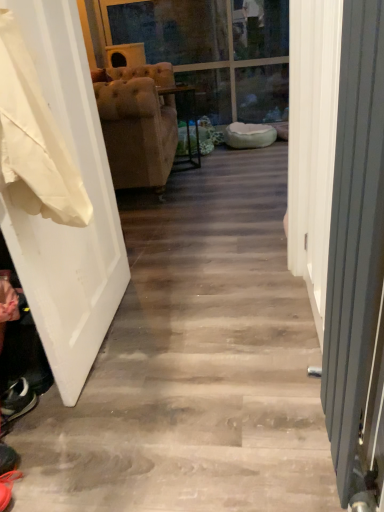
Question: Is transparent glass door at upper center bigger than metallic gray radiator at right?

Choices:
 (A) yes
 (B) no

Answer: (A)

Question: Considering the relative sizes of transparent glass door at upper center and metallic gray radiator at right in the image provided, is transparent glass door at upper center smaller than metallic gray radiator at right?

Choices:
 (A) yes
 (B) no

Answer: (B)

Question: Is transparent glass door at upper center located outside metallic gray radiator at right?

Choices:
 (A) yes
 (B) no

Answer: (A)

Question: Is there a large distance between transparent glass door at upper center and metallic gray radiator at right?

Choices:
 (A) no
 (B) yes

Answer: (B)

Question: Is transparent glass door at upper center next to metallic gray radiator at right and touching it?

Choices:
 (A) yes
 (B) no

Answer: (B)

Question: Is transparent glass door at upper center positioned with its back to metallic gray radiator at right?

Choices:
 (A) yes
 (B) no

Answer: (B)

Question: Are white fabric at left and white matte door at left beside each other?

Choices:
 (A) yes
 (B) no

Answer: (B)

Question: Considering the relative positions of white fabric at left and white matte door at left in the image provided, is white fabric at left to the left of white matte door at left from the viewer's perspective?

Choices:
 (A) yes
 (B) no

Answer: (B)

Question: Is white matte door at left a part of white fabric at left?

Choices:
 (A) yes
 (B) no

Answer: (B)

Question: Are white fabric at left and white matte door at left located far from each other?

Choices:
 (A) no
 (B) yes

Answer: (A)

Question: From the image's perspective, is white fabric at left under white matte door at left?

Choices:
 (A) yes
 (B) no

Answer: (B)

Question: Is white fabric at left wider than white matte door at left?

Choices:
 (A) no
 (B) yes

Answer: (B)

Question: Is white matte door at left positioned before transparent glass door at upper center?

Choices:
 (A) no
 (B) yes

Answer: (B)